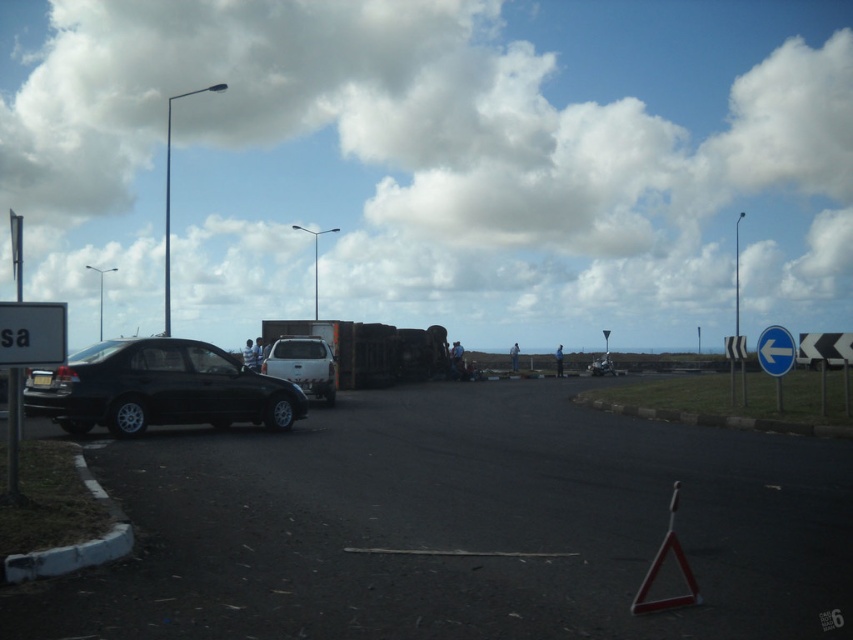
Question: Can you confirm if matte black car at left is positioned to the right of blue plastic sign at right?

Choices:
 (A) no
 (B) yes

Answer: (A)

Question: Among these objects, which one is farthest from the camera?

Choices:
 (A) white matte truck at center
 (B) black asphalt parking lot at lower left

Answer: (A)

Question: Which of these objects is positioned closest to the black asphalt parking lot at lower left?

Choices:
 (A) white matte truck at center
 (B) white fluffy cloud at upper center
 (C) blue plastic sign at right

Answer: (A)

Question: Can you confirm if white fluffy cloud at upper center is wider than matte black car at left?

Choices:
 (A) no
 (B) yes

Answer: (B)

Question: Which point is farther from the camera taking this photo?

Choices:
 (A) (537, 259)
 (B) (318, 352)
 (C) (10, 355)
 (D) (764, 344)

Answer: (A)

Question: Does black asphalt parking lot at lower left have a lesser width compared to white plastic sign at left?

Choices:
 (A) no
 (B) yes

Answer: (A)